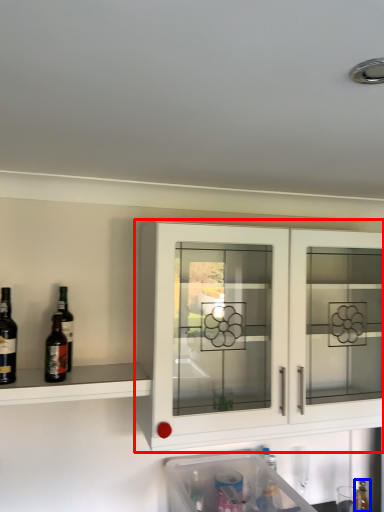
Question: Among these objects, which one is nearest to the camera, cabinetry (highlighted by a red box) or bottle (highlighted by a blue box)?

Choices:
 (A) cabinetry
 (B) bottle

Answer: (A)